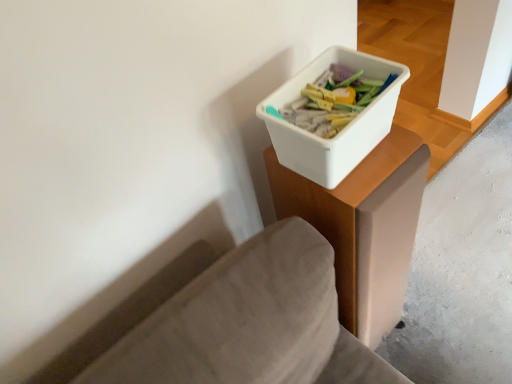
Where is `blank space situated above smooth concrete at lower right (from a real-world perspective)`? blank space situated above smooth concrete at lower right (from a real-world perspective) is located at coordinates [x=466, y=243].